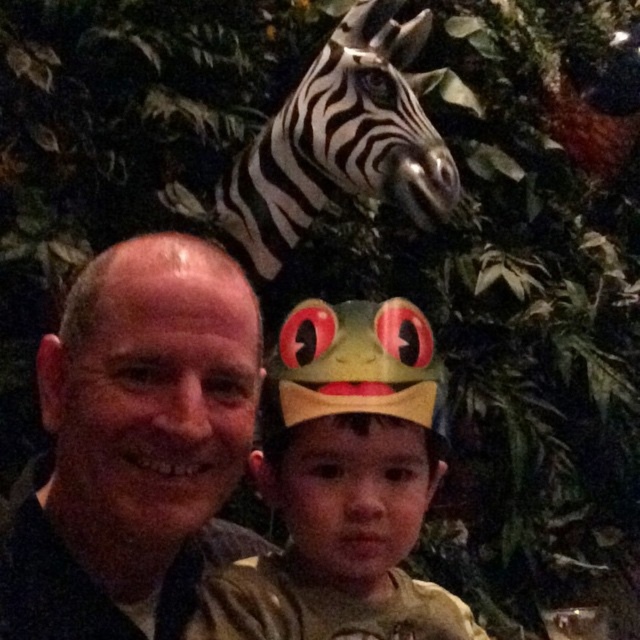
You are a visitor at the zoo and see the matte green paper crown at center and the matte black head at left. Which object is positioned to the right of the other?

The matte green paper crown at center is to the right of the matte black head at left.

You are a photographer trying to capture a clear shot of the matte black head at left and the black and white striped zebra head at upper center. Considering their sizes in the frame, which one would you need to zoom in more on to make them appear equally large in your photo?

The matte black head at left occupies less space than the black and white striped zebra head at upper center, so you would need to zoom in more on the matte black head at left to make it appear the same size as the zebra head.

You are a photographer trying to capture a clear shot of both the matte green paper crown at center and the matte black head at left. Since you want both objects to be fully visible in your photo, which object should you focus on first to ensure depth of field?

The matte green paper crown at center is taller than the matte black head at left, so you should focus on the taller object first to ensure both are in focus.